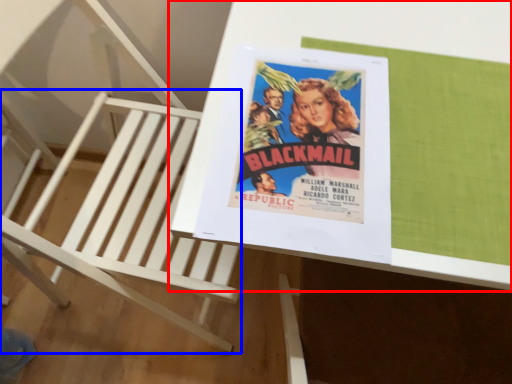
Question: Which object appears closest to the camera in this image, table (highlighted by a red box) or furniture (highlighted by a blue box)?

Choices:
 (A) table
 (B) furniture

Answer: (B)